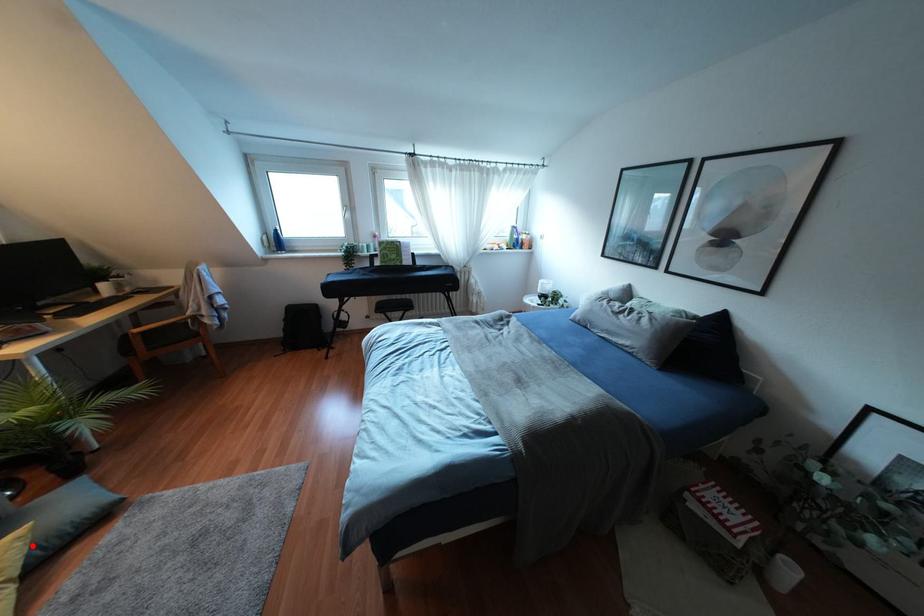
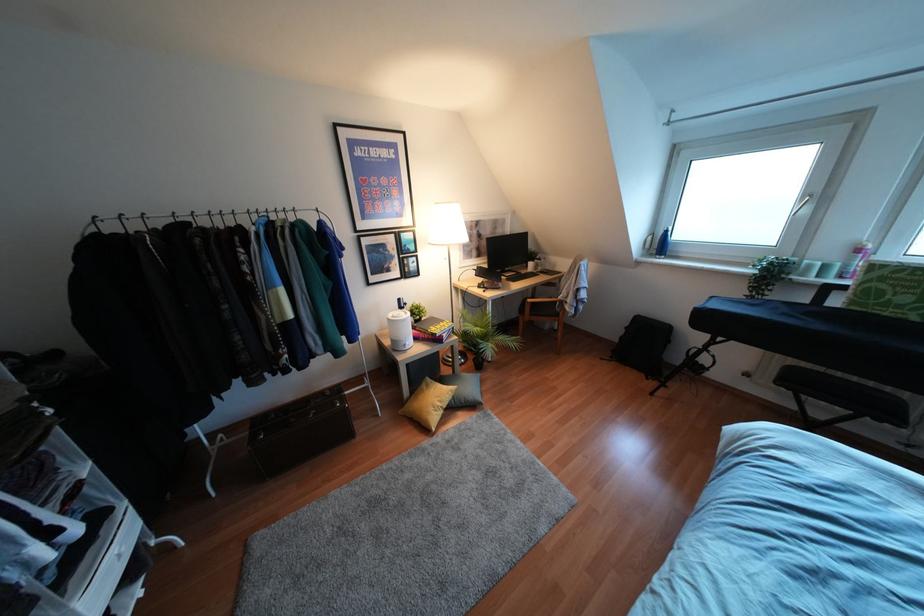
Question: I am providing you with two images of the same scene from different viewpoints. A red point is shown in image1. For the corresponding object point in image2, is it positioned nearer or farther from the camera?

Choices:
 (A) Nearer
 (B) Farther

Answer: (A)